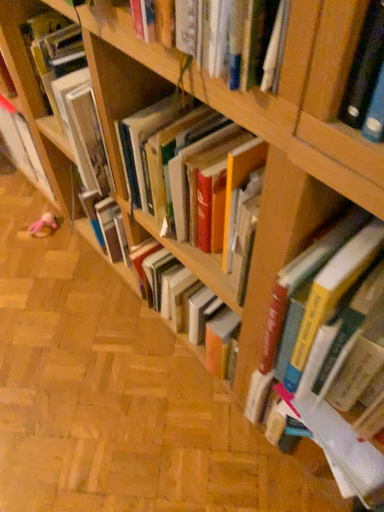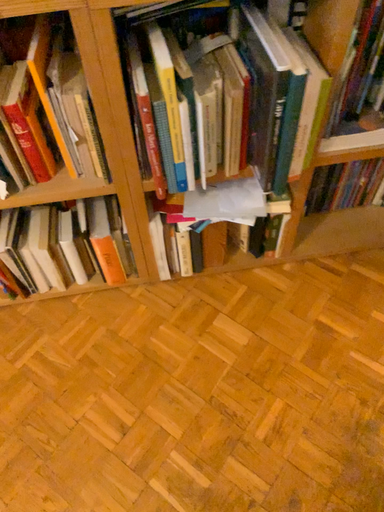
Question: Which way did the camera rotate in the video?

Choices:
 (A) rotated upward
 (B) rotated downward

Answer: (A)